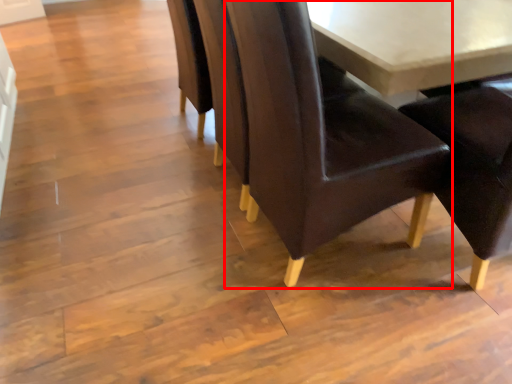
Question: Observing the image, what is the correct spatial positioning of chair (annotated by the red box) in reference to table?

Choices:
 (A) right
 (B) left

Answer: (B)